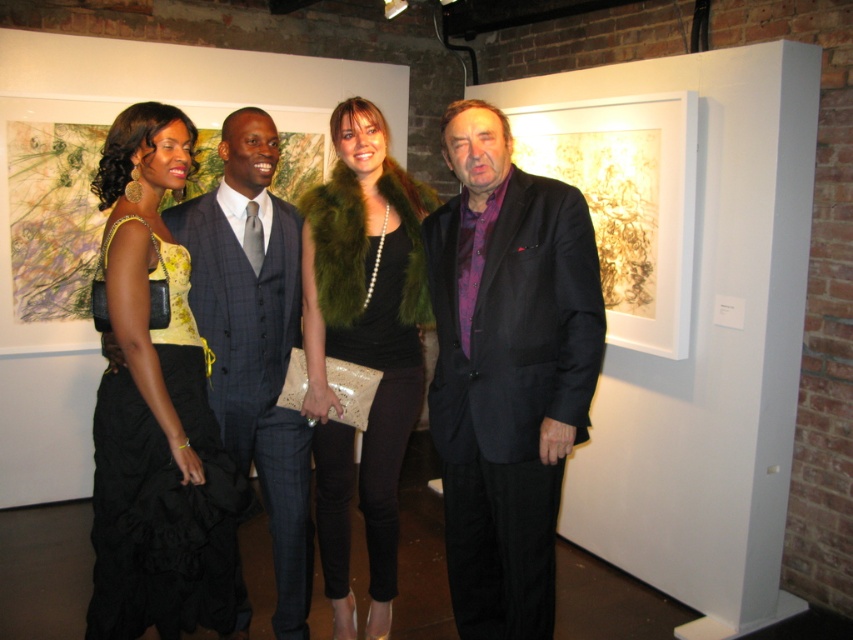
You are a photographer setting up for a group photo in an art gallery. You have a camera with a 1.2 meter wide lens. The subjects include a person wearing a black satin dress at left and another in a plaid wool business suit at center. Can both subjects fit within the camera lens width if positioned side by side?

The black satin dress at left is wider than the plaid wool business suit at center. Since their combined widths would exceed the camera lens width of 1.2 meters, they might not fit side by side. Check their exact measurements or adjust positions.

From the picture: You are an event planner arranging a photo shoot in an art gallery. You have two outfits to position in the center of the scene. The matte black suit at center and the green fur vest at center. The venue has a width restriction of 1.2 meters. Which outfit should you choose to ensure it fits within the space?

The matte black suit at center is wider than the green fur vest at center. Since the venue has a width restriction of 1.2 meters, you should choose the green fur vest at center to ensure it fits within the space.